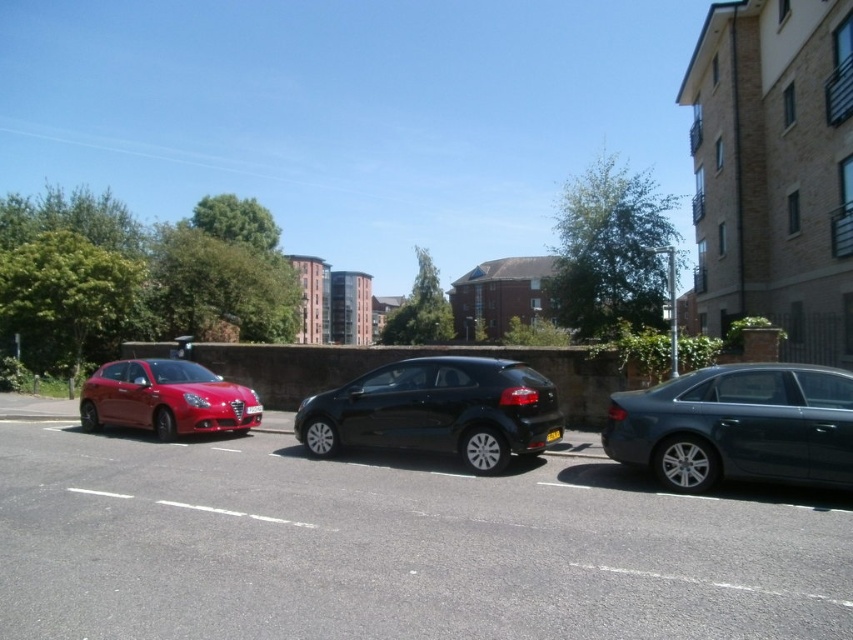
Question: Which point appears farthest from the camera in this image?

Choices:
 (A) (132, 390)
 (B) (509, 362)
 (C) (608, 433)

Answer: (A)

Question: Can you confirm if glossy metallic car at center is positioned below glossy black hatchback at center?

Choices:
 (A) no
 (B) yes

Answer: (B)

Question: Considering the real-world distances, which object is closest to the glossy black hatchback at center?

Choices:
 (A) matte red hatchback at left
 (B) satin dark gray sedan at right
 (C) glossy metallic car at center

Answer: (C)

Question: Which of the following is the closest to the observer?

Choices:
 (A) (689, 467)
 (B) (448, 435)
 (C) (254, 412)
 (D) (288, 561)

Answer: (D)

Question: Can you confirm if glossy metallic car at center is positioned above satin dark gray sedan at right?

Choices:
 (A) yes
 (B) no

Answer: (B)

Question: Considering the relative positions of glossy metallic car at center and satin dark gray sedan at right in the image provided, where is glossy metallic car at center located with respect to satin dark gray sedan at right?

Choices:
 (A) above
 (B) below

Answer: (B)